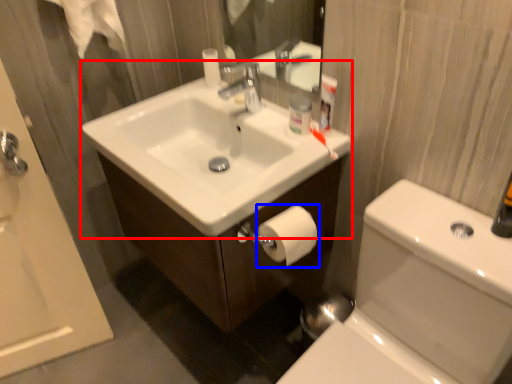
Question: Which of the following is the closest to the observer, sink (highlighted by a red box) or toilet paper (highlighted by a blue box)?

Choices:
 (A) sink
 (B) toilet paper

Answer: (A)